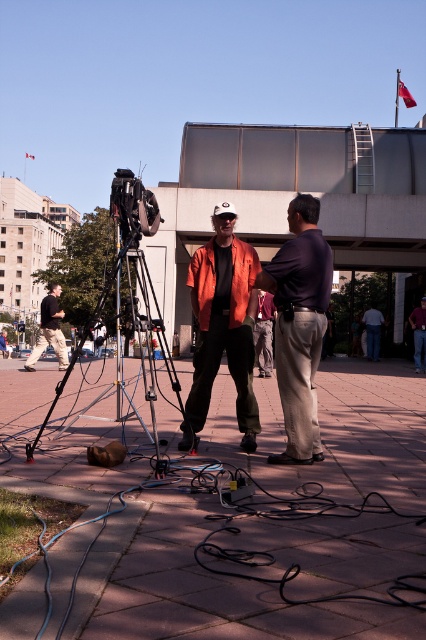
Based on the photo, you are a technician setting up equipment for an event. You need to place a new cable reel on the brown concrete pavement at center. Given that the ladder is leaning against the building in the background, can you determine if there is enough space between the ladder and the camera setup to safely place the reel?

The brown concrete pavement at center is located at point (210, 588). Since the ladder is against the building and the camera setup is on the pavement, there should be sufficient space between them to place the reel safely.

You are a technician trying to untangle the cables near the camera. You notice two points marked on the ground at coordinates point (131, 600) and point (321, 259). Which point is nearer to the camera where you are standing?

Point (131, 600) is closer to the camera than point (321, 259), so you should start untangling from there first.

You are a technician setting up a camera in the plaza. You need to place a new cable from the camera to the equipment box located at point (210, 588). The existing cables are tangled and occupy most of the space. Is there enough space left on the brown concrete pavement at center to lay the new cable without crossing over the existing cables?

The brown concrete pavement at center is located at point (210, 588), so there is no space left to lay the new cable without overlapping the existing cables.